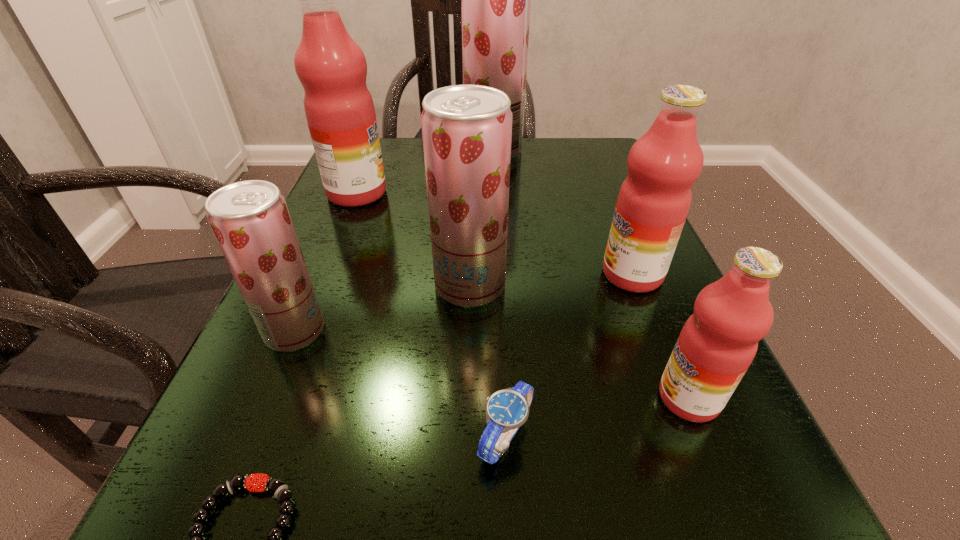
Find the location of a particular element. This screenshot has height=540, width=960. vacant space that is in between the fourth nearest object and the blue watch is located at coordinates (400, 383).

Where is `vacant point located between the second farthest fruit juice and the second nearest strawberry fruit juice`? The image size is (960, 540). vacant point located between the second farthest fruit juice and the second nearest strawberry fruit juice is located at coordinates (414, 239).

This screenshot has height=540, width=960. I want to click on vacant area between the second nearest strawberry fruit juice and the second farthest fruit juice, so click(x=414, y=239).

You are a GUI agent. You are given a task and a screenshot of the screen. Output one action in this format:
    pyautogui.click(x=<x>, y=<y>)
    Task: Click on the unoccupied area between the smallest pink fruit juice and the fifth farthest fruit juice
    Image resolution: width=960 pixels, height=540 pixels.
    Given the screenshot: What is the action you would take?
    pyautogui.click(x=492, y=364)

The height and width of the screenshot is (540, 960). Find the location of `vacant point located between the blue watch and the second farthest object`. vacant point located between the blue watch and the second farthest object is located at coordinates (431, 314).

The height and width of the screenshot is (540, 960). In order to click on empty space between the nearest strawberry fruit juice and the nearest pink fruit juice in this screenshot , I will do `click(492, 364)`.

Identify the location of vacant space that's between the leftmost strawberry fruit juice and the second nearest strawberry fruit juice. (382, 308).

Locate which object ranks in proximity to the smallest strawberry fruit juice. Please provide its 2D coordinates. Your answer should be formatted as a tuple, i.e. [(x, y)], where the tuple contains the x and y coordinates of a point satisfying the conditions above.

[(467, 129)]

I want to click on object identified as the fourth closest to the blue watch, so click(x=250, y=220).

The width and height of the screenshot is (960, 540). I want to click on fruit juice that is the third nearest to the second farthest fruit juice, so click(x=250, y=220).